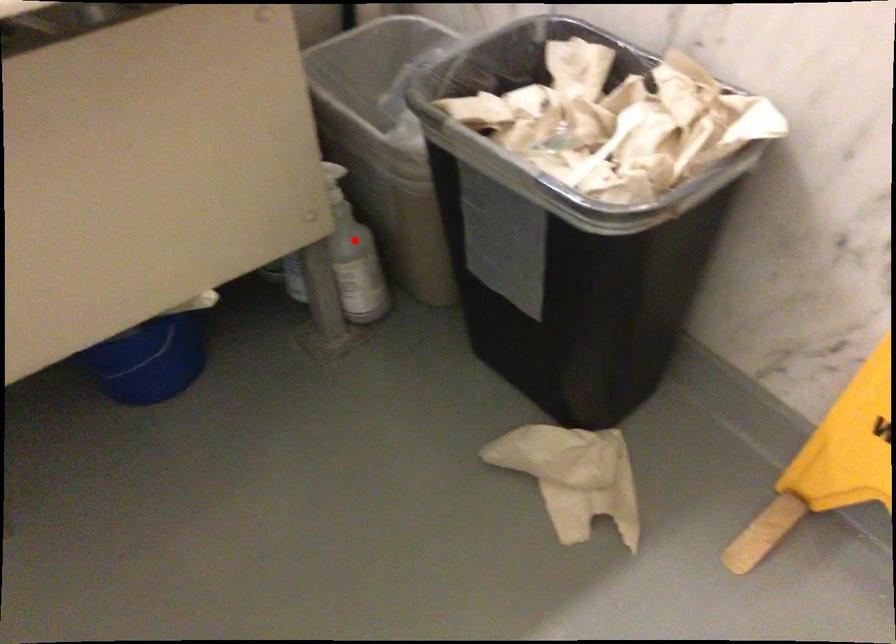
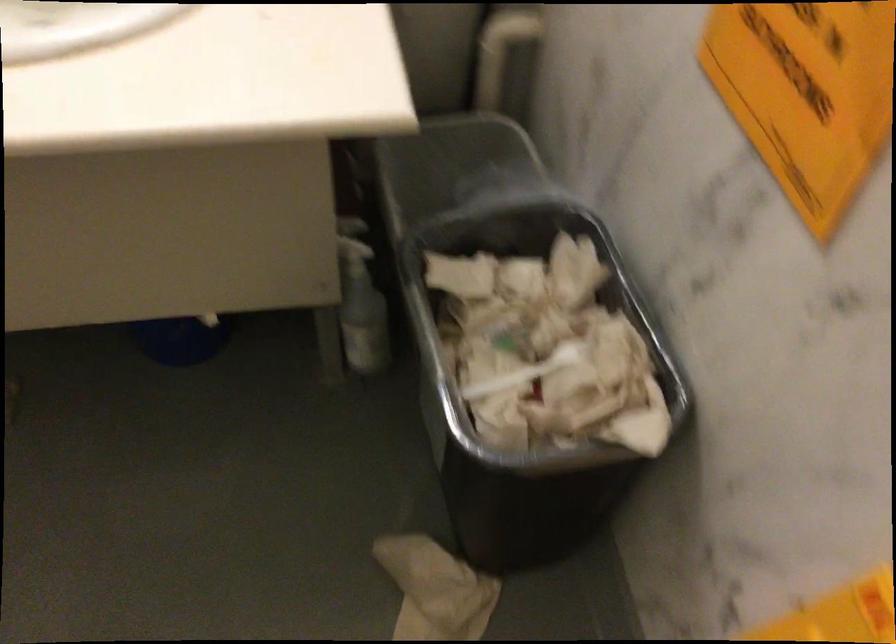
The point at the highlighted location is marked in the first image. Where is the corresponding point in the second image?

(360, 303)